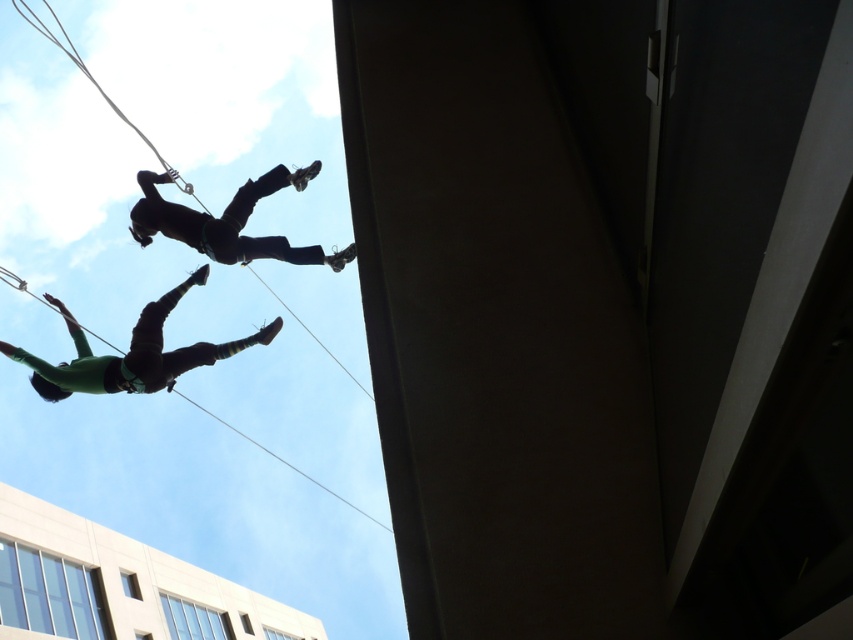
Which of these two, green matte/silky shirt at lower left or black matte/soft material person at upper center, stands taller?

With more height is green matte/silky shirt at lower left.

Is the position of green matte/silky shirt at lower left more distant than that of black matte/soft material person at upper center?

Yes, green matte/silky shirt at lower left is further from the viewer.

Between point (62, 369) and point (239, 212), which one is positioned behind?

Point (239, 212)

This screenshot has width=853, height=640. What are the coordinates of `green matte/silky shirt at lower left` in the screenshot? It's located at (131, 353).